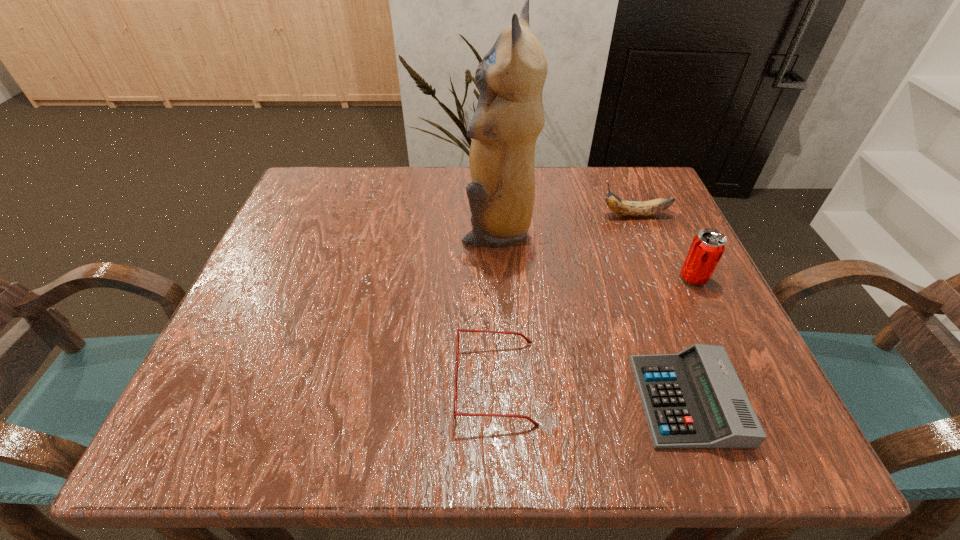
The width and height of the screenshot is (960, 540). In order to click on calculator situated at the near edge in this screenshot , I will do `click(693, 399)`.

Where is `soda can that is at the right edge`? soda can that is at the right edge is located at coordinates (708, 246).

Where is `banana that is at the right edge`? The height and width of the screenshot is (540, 960). banana that is at the right edge is located at coordinates (627, 208).

Locate an element on the screen. The width and height of the screenshot is (960, 540). calculator at the right edge is located at coordinates (693, 399).

This screenshot has width=960, height=540. In order to click on object that is at the far right corner in this screenshot , I will do `click(627, 208)`.

Locate an element on the screen. This screenshot has width=960, height=540. object that is positioned at the near right corner is located at coordinates (693, 399).

This screenshot has width=960, height=540. What are the coordinates of `vacant space at the far edge` in the screenshot? It's located at pyautogui.click(x=570, y=187).

What are the coordinates of `free space at the near edge of the desktop` in the screenshot? It's located at (305, 420).

You are a GUI agent. You are given a task and a screenshot of the screen. Output one action in this format:
    pyautogui.click(x=<x>, y=<y>)
    Task: Click on the vacant area at the left edge of the desktop
    The image size is (960, 540).
    Given the screenshot: What is the action you would take?
    [320, 268]

In the image, there is a desktop. Identify the location of free region at the right edge. (702, 321).